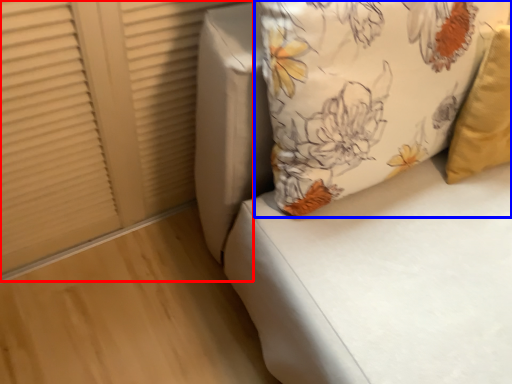
Question: Among these objects, which one is farthest to the camera, shutter (highlighted by a red box) or pillow (highlighted by a blue box)?

Choices:
 (A) shutter
 (B) pillow

Answer: (A)